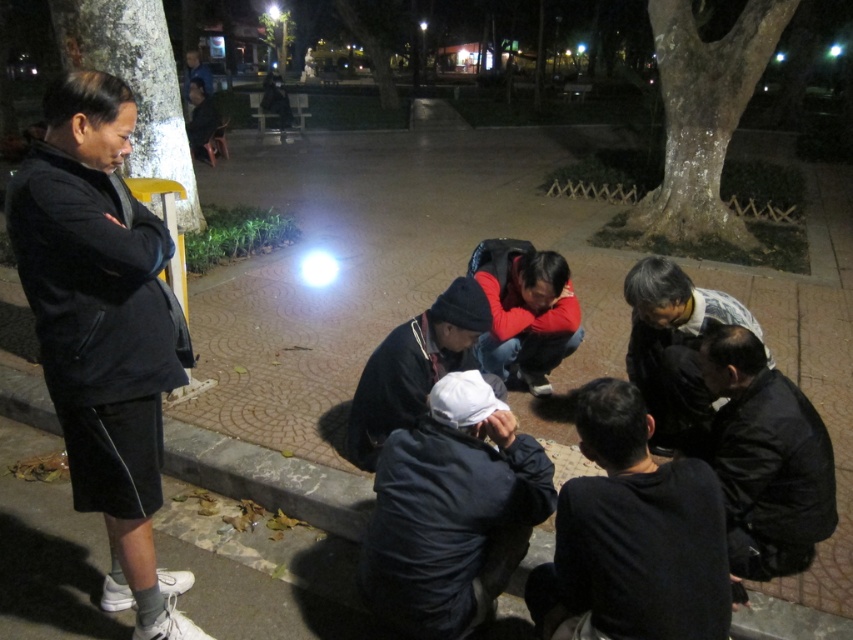
Question: Which object appears closest to the camera in this image?

Choices:
 (A) dark gray jacket at lower right
 (B) dark matte jacket at lower center
 (C) black matte jacket at lower right

Answer: (B)

Question: Does black matte jacket at left have a lesser width compared to red matte jacket at center?

Choices:
 (A) no
 (B) yes

Answer: (B)

Question: Is dark matte jacket at lower center behind red matte jacket at center?

Choices:
 (A) no
 (B) yes

Answer: (A)

Question: From the image, what is the correct spatial relationship of black matte jacket at left in relation to black matte jacket at lower right?

Choices:
 (A) left
 (B) right

Answer: (A)

Question: Which of these objects is positioned closest to the black matte jacket at lower right?

Choices:
 (A) dark matte jacket at lower center
 (B) dark gray jacket at lower right
 (C) black matte jacket at left
 (D) black matte jacket at center

Answer: (B)

Question: Among these points, which one is farthest from the camera?

Choices:
 (A) (512, 244)
 (B) (705, 403)
 (C) (688, 522)
 (D) (770, 456)

Answer: (A)